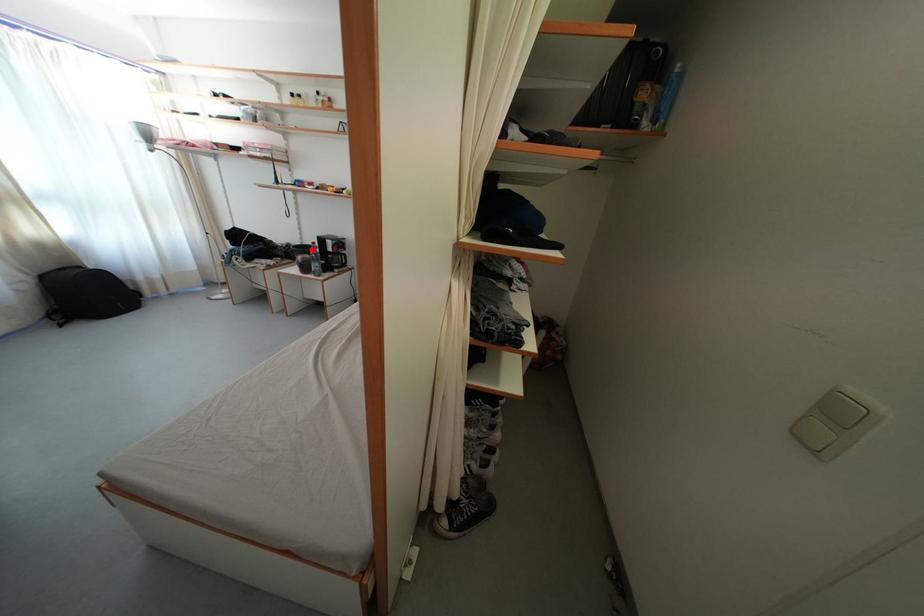
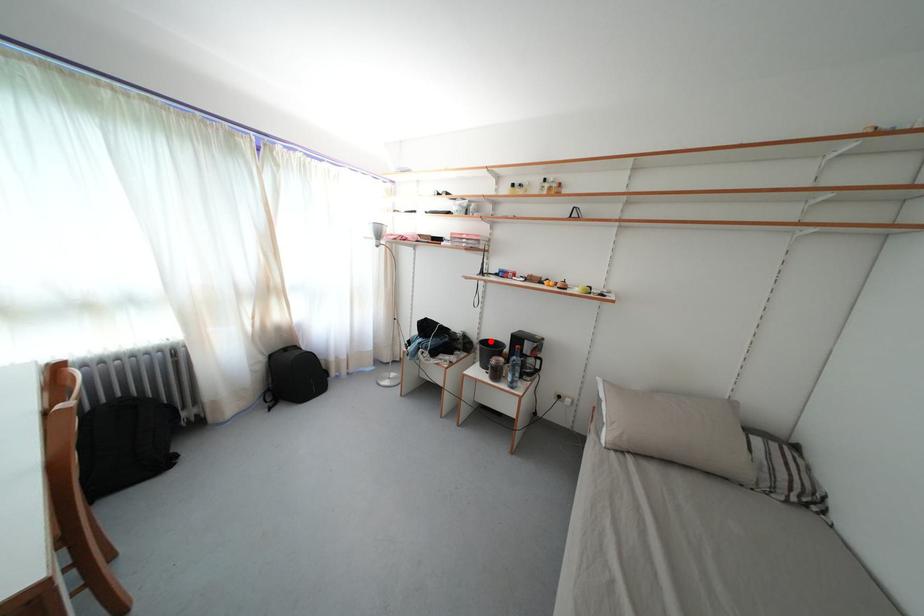
I am providing you with two images of the same scene from different viewpoints. A red point is marked on the first image and another point is marked on the second image. Is the marked point in image1 the same physical position as the marked point in image2?

Yes